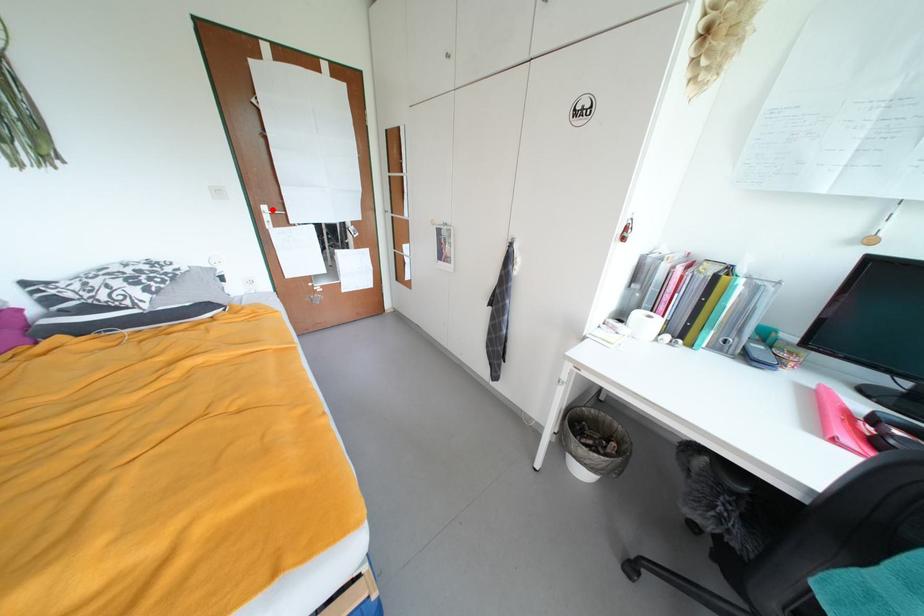
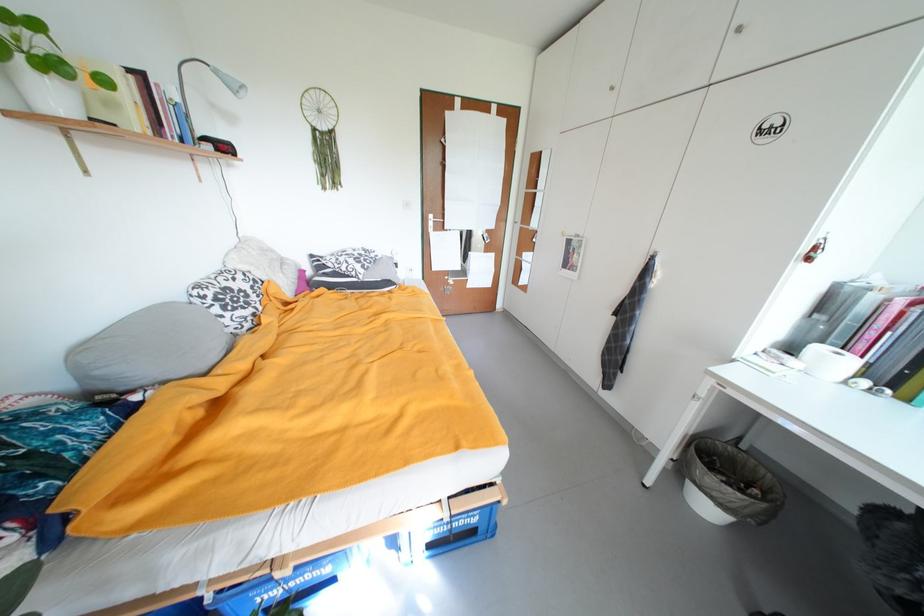
In the second image, find the point that corresponds to the highlighted location in the first image.

(439, 217)